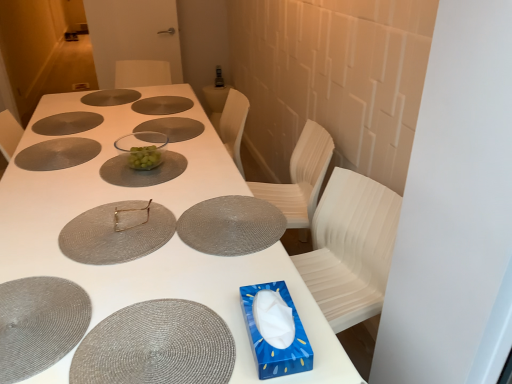
I want to click on free area in between matte gray placemat at lower center, the first glass plate in the front-to-back sequence, and transparent glass bowl at center, the fourth glass plate viewed from the back, so click(169, 203).